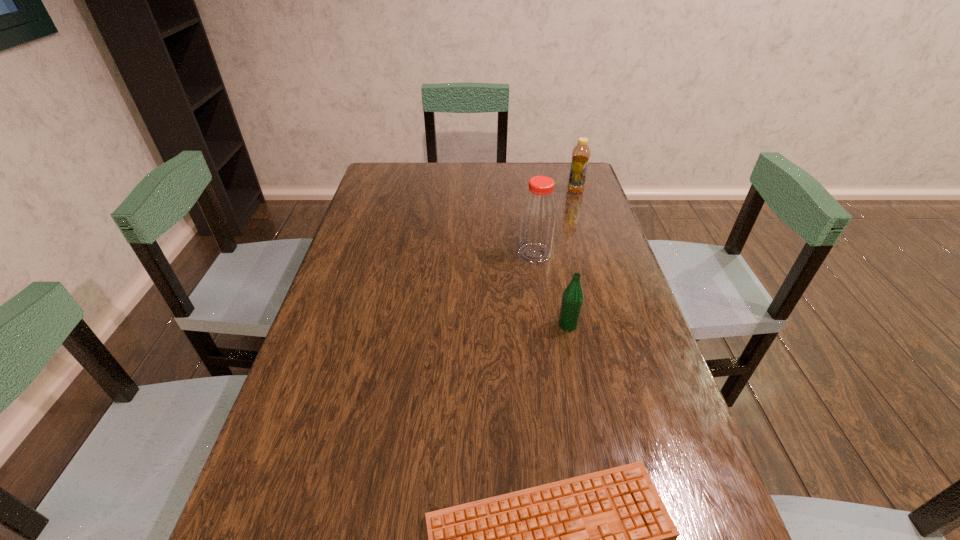
Locate an element on the screen. This screenshot has width=960, height=540. object that is the third closest to the third nearest object is located at coordinates (602, 539).

Identify which object is located as the nearest to the third farthest object. Please provide its 2D coordinates. Your answer should be formatted as a tuple, i.e. [(x, y)], where the tuple contains the x and y coordinates of a point satisfying the conditions above.

[(538, 214)]

Locate an element on the screen. bottle object that ranks as the second closest to the shortest object is located at coordinates (538, 214).

Locate an element on the screen. The width and height of the screenshot is (960, 540). bottle that stands as the third closest to the computer keyboard is located at coordinates (581, 153).